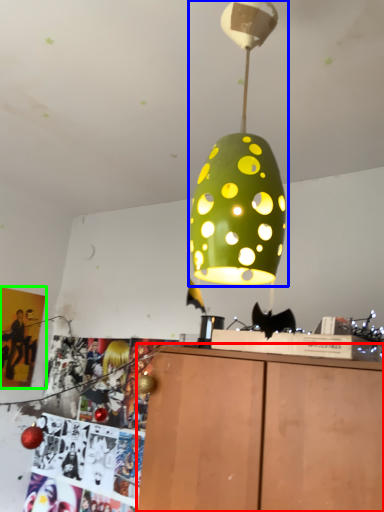
Question: Which object is positioned farthest from furniture (highlighted by a red box)? Select from lamp (highlighted by a blue box) and poster page (highlighted by a green box).

Choices:
 (A) lamp
 (B) poster page

Answer: (B)